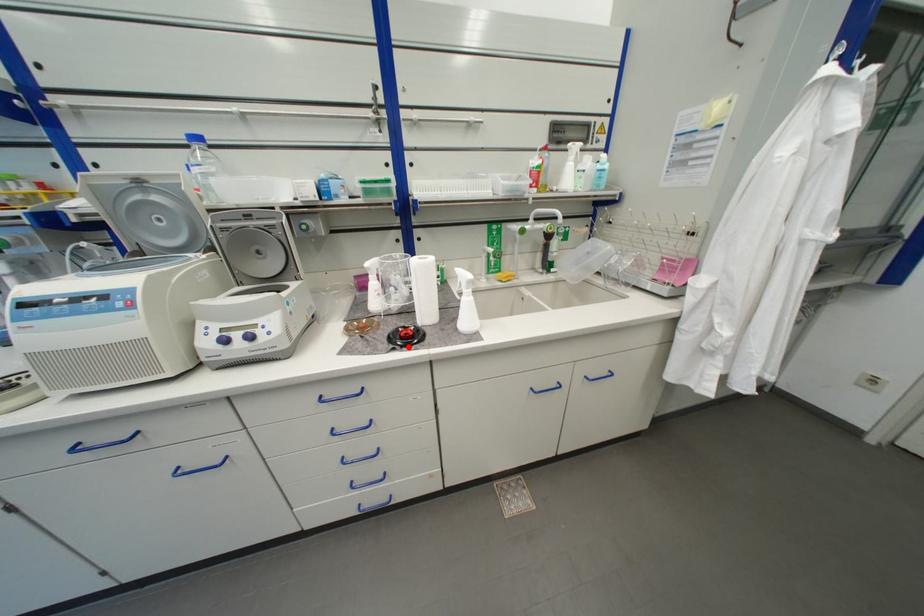
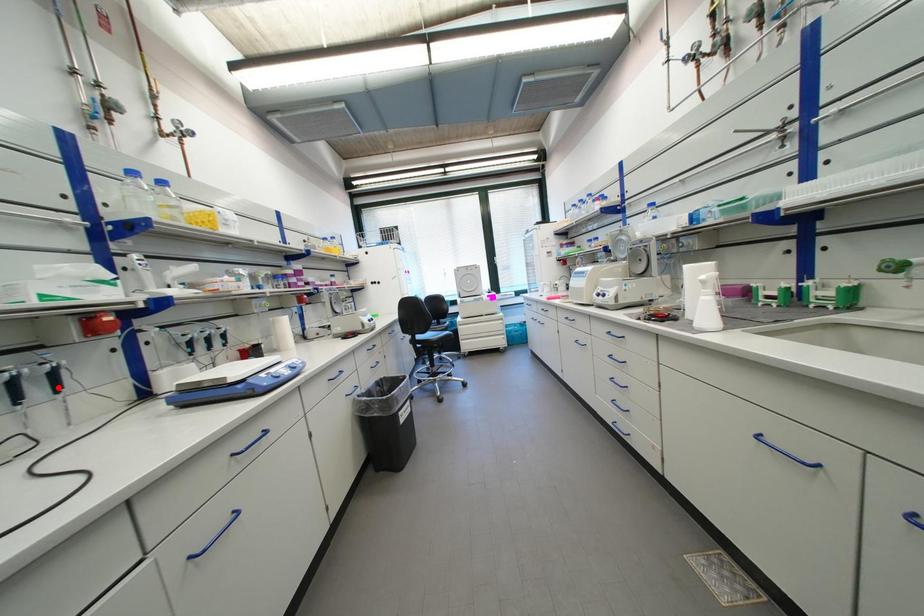
I am providing you with two images of the same scene from different viewpoints. A red point is marked on the first image and another point is marked on the second image. Is the red point in image1 aligned with the point shown in image2?

No